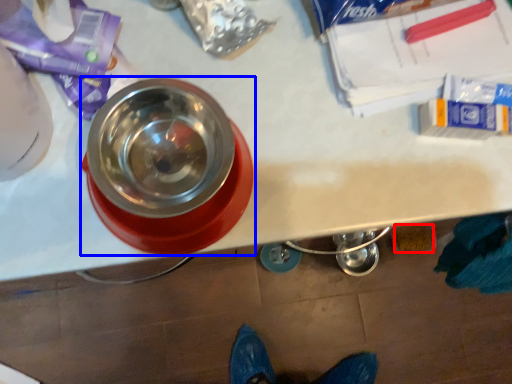
Question: Which object is closer to the camera taking this photo, debris (highlighted by a red box) or tableware (highlighted by a blue box)?

Choices:
 (A) debris
 (B) tableware

Answer: (B)